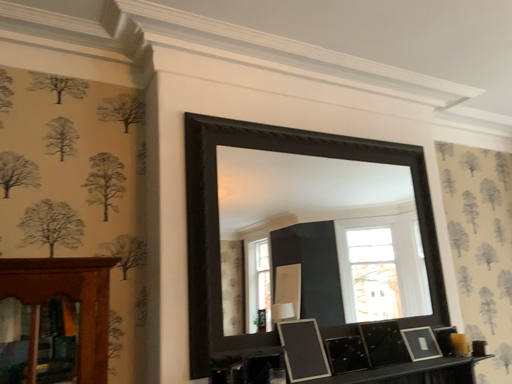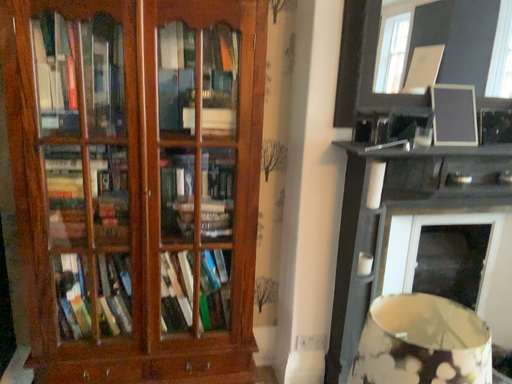
Question: Which way did the camera rotate in the video?

Choices:
 (A) rotated upward
 (B) rotated downward

Answer: (B)